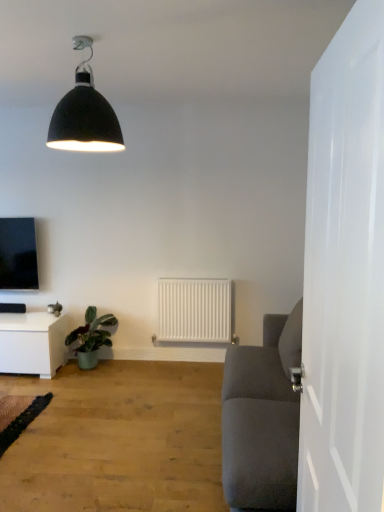
The width and height of the screenshot is (384, 512). What are the coordinates of `light brown wood floor at lower left` in the screenshot? It's located at (119, 440).

This screenshot has width=384, height=512. What do you see at coordinates (194, 310) in the screenshot? I see `white matte radiator at center` at bounding box center [194, 310].

In order to click on white glossy door at right in this screenshot , I will do [x=344, y=274].

Locate an element on the screen. white glossy table at lower left is located at coordinates (33, 343).

This screenshot has width=384, height=512. What do you see at coordinates (91, 337) in the screenshot? I see `green glossy plant at lower left` at bounding box center [91, 337].

Identify the location of light brown wood floor at lower left. (119, 440).

Is point (89, 83) closer or farther from the camera than point (94, 349)?

Point (89, 83) appears to be closer to the viewer than point (94, 349).

In order to click on lamp above the green glossy plant at lower left (from the image's perspective) in this screenshot , I will do `click(84, 113)`.

From a real-world perspective, is matte black lampshade at upper center physically located above or below green glossy plant at lower left?

In terms of real-world spatial position, matte black lampshade at upper center is above green glossy plant at lower left.

Is matte black tv at upper left bigger than white glossy table at lower left?

Actually, matte black tv at upper left might be smaller than white glossy table at lower left.

From a real-world perspective, between matte black tv at upper left and white glossy table at lower left, who is vertically higher?

From a 3D spatial view, matte black tv at upper left is above.

Which of these two, matte black tv at upper left or white glossy table at lower left, is wider?

white glossy table at lower left is wider.

Which object is more forward, matte black tv at upper left or white glossy table at lower left?

white glossy table at lower left is in front.

Considering the relative positions of matte black lampshade at upper center and white matte radiator at center in the image provided, is matte black lampshade at upper center behind white matte radiator at center?

No, matte black lampshade at upper center is closer to the camera.

Is point (112, 129) farther from viewer compared to point (231, 302)?

That is False.

You are a GUI agent. You are given a task and a screenshot of the screen. Output one action in this format:
    pyautogui.click(x=<x>, y=<y>)
    Task: Click on the lamp located on the left of white matte radiator at center
    
    Given the screenshot: What is the action you would take?
    pyautogui.click(x=84, y=113)

From the image's perspective, between matte black lampshade at upper center and white matte radiator at center, which one is located above?

From the image's view, matte black lampshade at upper center is above.

Considering the points (68, 343) and (378, 443), which point is behind, point (68, 343) or point (378, 443)?

The point (68, 343) is more distant.

Who is shorter, green glossy plant at lower left or white glossy door at right?

green glossy plant at lower left.

From a real-world perspective, is green glossy plant at lower left on top of white glossy door at right?

Incorrect, from a real-world perspective, green glossy plant at lower left is lower than white glossy door at right.

Does white matte radiator at center contain matte black tv at upper left?

No.

Considering the points (214, 295) and (28, 249), which point is in front, point (214, 295) or point (28, 249)?

The point (214, 295) is in front.

In the image, is white matte radiator at center on the left side or the right side of matte black tv at upper left?

From the image, it's evident that white matte radiator at center is to the right of matte black tv at upper left.

Relative to matte black tv at upper left, is white matte radiator at center in front or behind?

In the image, white matte radiator at center appears in front of matte black tv at upper left.

Is white glossy door at right taller than white glossy table at lower left?

Yes, white glossy door at right is taller than white glossy table at lower left.

From the image's perspective, would you say white glossy door at right is shown under white glossy table at lower left?

No.

Is white glossy door at right at the right side of white glossy table at lower left?

Yes.

Consider the image. Is white glossy door at right placed right next to white glossy table at lower left?

No, white glossy door at right is not making contact with white glossy table at lower left.

Which is in front, light brown wood floor at lower left or matte black lampshade at upper center?

matte black lampshade at upper center is in front.

Based on the photo, what's the angular difference between light brown wood floor at lower left and matte black lampshade at upper center's facing directions?

5.79 degrees.

Identify the location of plain located underneath the matte black lampshade at upper center (from a real-world perspective). (119, 440).

Is light brown wood floor at lower left thinner than matte black lampshade at upper center?

Incorrect, the width of light brown wood floor at lower left is not less than that of matte black lampshade at upper center.

Locate an element on the screen. The height and width of the screenshot is (512, 384). lamp above the green glossy plant at lower left (from a real-world perspective) is located at coordinates pyautogui.click(x=84, y=113).

Where is `table in front of the matte black tv at upper left`? The image size is (384, 512). table in front of the matte black tv at upper left is located at coordinates (33, 343).

Based on the photo, considering their positions, is white glossy door at right positioned further to light brown wood floor at lower left than white glossy table at lower left?

white glossy door at right is further to light brown wood floor at lower left.

Consider the image. Estimate the real-world distances between objects in this image. Which object is further from white glossy table at lower left, matte black tv at upper left or white glossy door at right?

white glossy door at right.

Based on their spatial positions, is white matte radiator at center or white glossy door at right further from white glossy table at lower left?

white glossy door at right is further to white glossy table at lower left.

Estimate the real-world distances between objects in this image. Which object is further from white glossy door at right, matte black tv at upper left or matte black lampshade at upper center?

matte black tv at upper left is positioned further to the anchor white glossy door at right.

From the image, which object appears to be farther from light brown wood floor at lower left, matte black lampshade at upper center or white glossy table at lower left?

matte black lampshade at upper center lies further to light brown wood floor at lower left than the other object.

Considering their positions, is matte black tv at upper left positioned closer to white glossy door at right than white matte radiator at center?

white matte radiator at center is positioned closer to the anchor white glossy door at right.

Which object lies nearer to the anchor point white matte radiator at center, matte black tv at upper left or matte black lampshade at upper center?

The object closer to white matte radiator at center is matte black tv at upper left.

When comparing their distances from matte black tv at upper left, does white matte radiator at center or matte black lampshade at upper center seem closer?

Among the two, white matte radiator at center is located nearer to matte black tv at upper left.

Image resolution: width=384 pixels, height=512 pixels. In order to click on radiator between white glossy door at right and matte black tv at upper left in the front-back direction in this screenshot , I will do `click(194, 310)`.

This screenshot has width=384, height=512. What are the coordinates of `table located between light brown wood floor at lower left and matte black tv at upper left in the depth direction` in the screenshot? It's located at [33, 343].

At what (x,y) coordinates should I click in order to perform the action: click on table between matte black tv at upper left and white matte radiator at center in the horizontal direction. Please return your answer as a coordinate pair (x, y). The height and width of the screenshot is (512, 384). Looking at the image, I should click on (33, 343).

Find the location of a particular element. The width and height of the screenshot is (384, 512). houseplant between white glossy door at right and matte black tv at upper left along the z-axis is located at coordinates (91, 337).